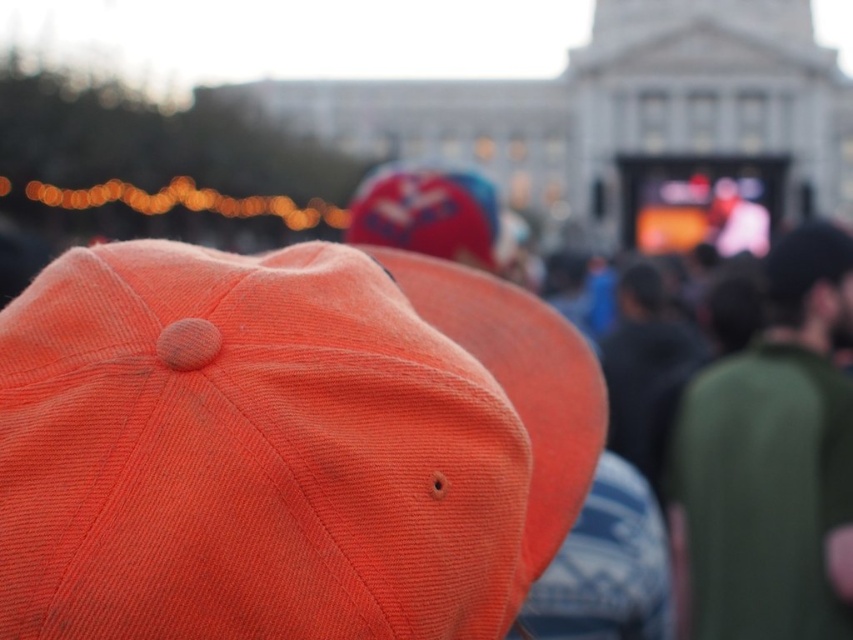
Question: Is orange corduroy baseball cap at center in front of green cotton shirt at right?

Choices:
 (A) no
 (B) yes

Answer: (B)

Question: Does orange corduroy baseball cap at center lie in front of green cotton shirt at right?

Choices:
 (A) no
 (B) yes

Answer: (B)

Question: Does orange corduroy baseball cap at center have a greater width compared to green cotton shirt at right?

Choices:
 (A) no
 (B) yes

Answer: (B)

Question: Which point is farther to the camera?

Choices:
 (A) green cotton shirt at right
 (B) orange corduroy baseball cap at center

Answer: (A)